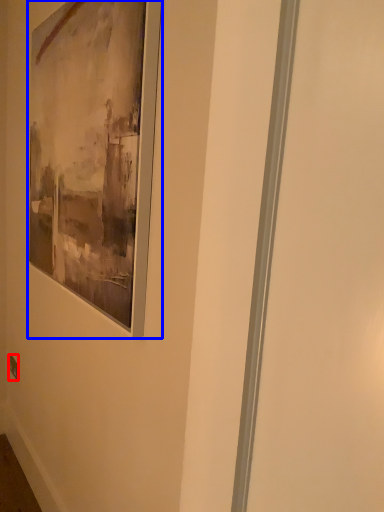
Question: Among these objects, which one is farthest to the camera, electric outlet (highlighted by a red box) or picture frame (highlighted by a blue box)?

Choices:
 (A) electric outlet
 (B) picture frame

Answer: (A)